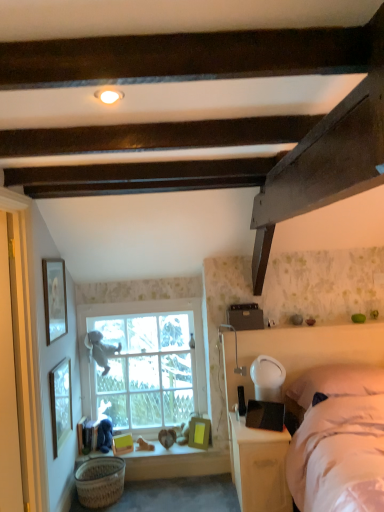
You are a GUI agent. You are given a task and a screenshot of the screen. Output one action in this format:
    pyautogui.click(x=<x>, y=<y>)
    Task: Click on the blank space situated above white fabric bed at right (from a real-world perspective)
    Image resolution: width=384 pixels, height=512 pixels.
    Given the screenshot: What is the action you would take?
    pyautogui.click(x=310, y=327)